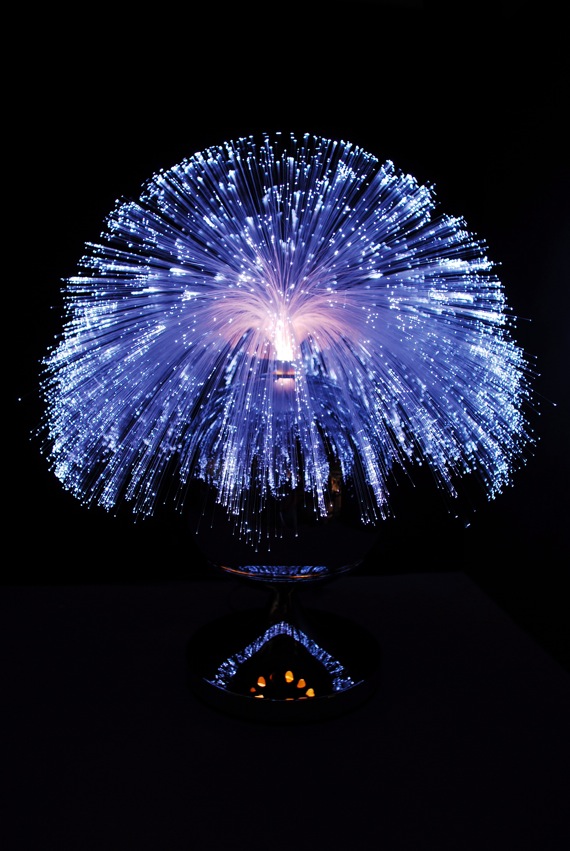
You are a GUI agent. You are given a task and a screenshot of the screen. Output one action in this format:
    pyautogui.click(x=<x>, y=<y>)
    Task: Click on the light lines
    
    Given the screenshot: What is the action you would take?
    pyautogui.click(x=368, y=493), pyautogui.click(x=357, y=483), pyautogui.click(x=363, y=505)